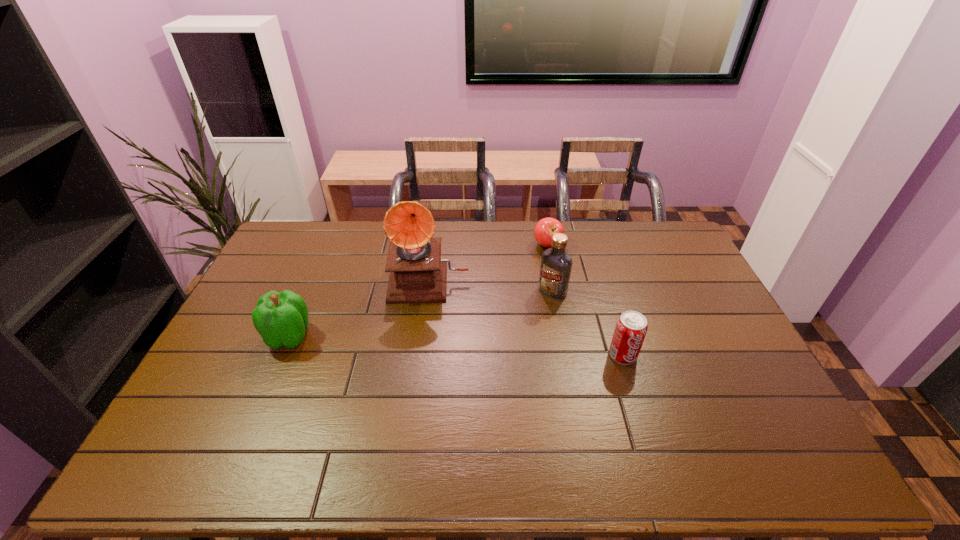
I want to click on phonograph record that is at the far edge, so click(x=418, y=274).

Identify the location of object that is at the left edge. (281, 318).

Where is `vacant space at the far edge of the desktop`? The image size is (960, 540). vacant space at the far edge of the desktop is located at coordinates (599, 243).

At what (x,y) coordinates should I click in order to perform the action: click on vacant space at the near edge of the desktop. Please return your answer as a coordinate pair (x, y). Image resolution: width=960 pixels, height=540 pixels. Looking at the image, I should click on (638, 427).

Locate an element on the screen. The width and height of the screenshot is (960, 540). vacant space at the left edge is located at coordinates (298, 271).

The height and width of the screenshot is (540, 960). In the image, there is a desktop. Identify the location of vacant region at the right edge. (x=731, y=360).

In the image, there is a desktop. Where is `free region at the far right corner`? The height and width of the screenshot is (540, 960). free region at the far right corner is located at coordinates (636, 232).

The width and height of the screenshot is (960, 540). In the image, there is a desktop. In order to click on vacant space at the near right corner in this screenshot , I will do `click(725, 425)`.

Identify the location of free spot between the rightmost object and the apple. (586, 300).

You are a GUI agent. You are given a task and a screenshot of the screen. Output one action in this format:
    pyautogui.click(x=<x>, y=<y>)
    Task: Click on the vacant point located between the vodka and the soda can
    
    Given the screenshot: What is the action you would take?
    pyautogui.click(x=588, y=323)